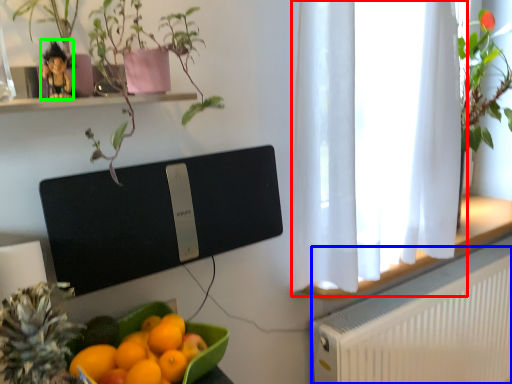
Question: Which object is positioned farthest from window frame (highlighted by a red box)? Select from radiator (highlighted by a blue box) and toy (highlighted by a green box).

Choices:
 (A) radiator
 (B) toy

Answer: (B)